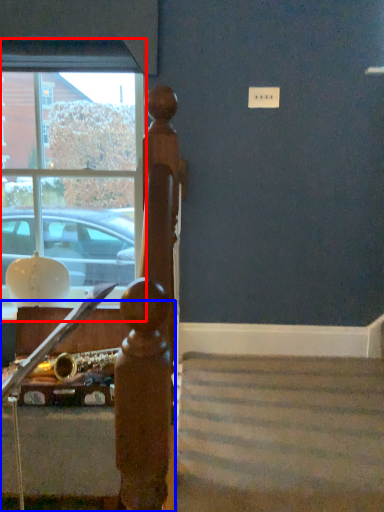
Question: Among these objects, which one is nearest to the camera, window (highlighted by a red box) or furniture (highlighted by a blue box)?

Choices:
 (A) window
 (B) furniture

Answer: (B)